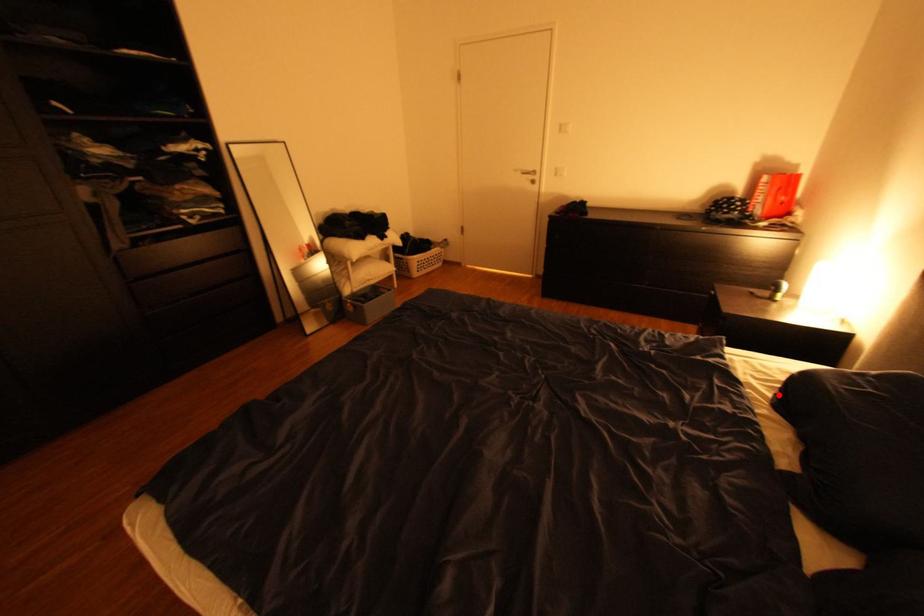
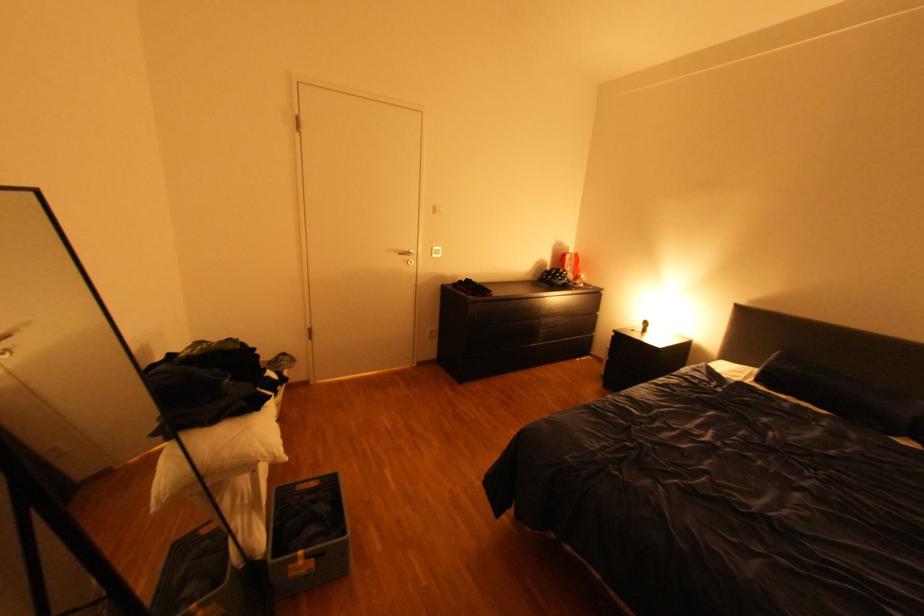
The point at the highlighted location is marked in the first image. Where is the corresponding point in the second image?

(771, 387)